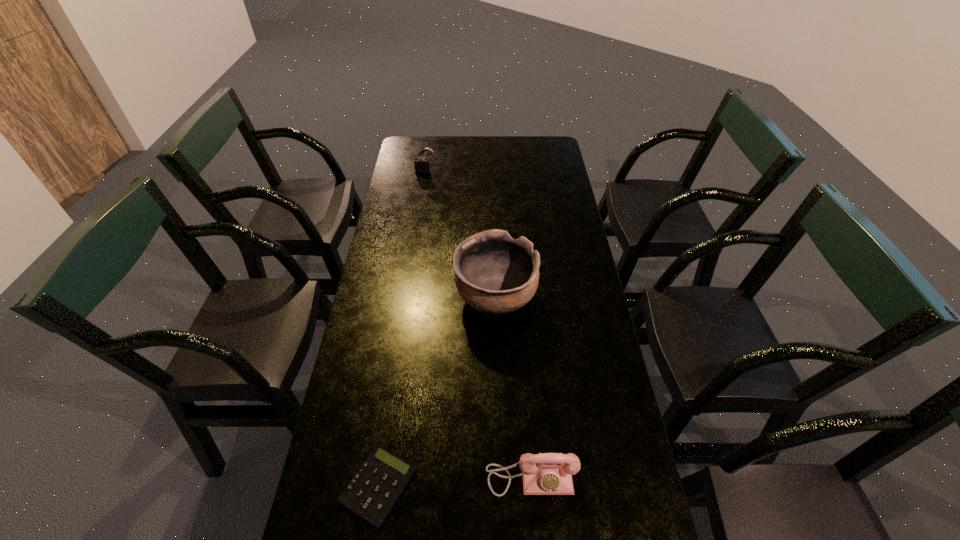
Image resolution: width=960 pixels, height=540 pixels. Find the location of `calculator located at the left edge`. calculator located at the left edge is located at coordinates (376, 486).

Where is `object present at the right edge`? The image size is (960, 540). object present at the right edge is located at coordinates 545,473.

In the image, there is a desktop. Where is `vacant space at the far edge`? This screenshot has width=960, height=540. vacant space at the far edge is located at coordinates (444, 145).

Locate an element on the screen. This screenshot has height=540, width=960. vacant area at the left edge is located at coordinates (423, 199).

In the image, there is a desktop. Identify the location of vacant space at the right edge. This screenshot has height=540, width=960. (609, 363).

The height and width of the screenshot is (540, 960). In order to click on free space at the far right corner of the desktop in this screenshot , I will do `click(558, 140)`.

I want to click on free space between the pottery and the telephone, so click(x=513, y=387).

Identify the location of vacant area that lies between the telephone and the padlock. (478, 324).

I want to click on free area in between the telephone and the tallest object, so click(x=513, y=387).

Find the location of `vacant area between the telephone and the padlock`. vacant area between the telephone and the padlock is located at coordinates (478, 324).